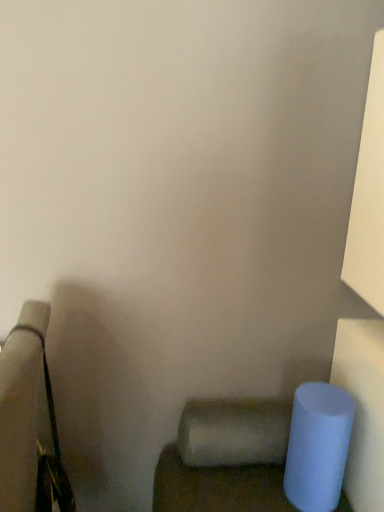
Question: From the image's perspective, is matte blue cylinder at lower right on satin white toilet paper at lower center?

Choices:
 (A) no
 (B) yes

Answer: (A)

Question: Is satin white toilet paper at lower center completely or partially inside matte blue cylinder at lower right?

Choices:
 (A) yes
 (B) no

Answer: (B)

Question: Can we say matte blue cylinder at lower right lies outside satin white toilet paper at lower center?

Choices:
 (A) no
 (B) yes

Answer: (B)

Question: Is matte blue cylinder at lower right wider than satin white toilet paper at lower center?

Choices:
 (A) no
 (B) yes

Answer: (B)

Question: Can you confirm if matte blue cylinder at lower right is positioned to the left of satin white toilet paper at lower center?

Choices:
 (A) yes
 (B) no

Answer: (B)

Question: Is satin white toilet paper at lower center at the back of matte blue cylinder at lower right?

Choices:
 (A) no
 (B) yes

Answer: (A)

Question: Can we say satin white toilet paper at lower center lies outside matte blue cylinder at lower right?

Choices:
 (A) no
 (B) yes

Answer: (B)

Question: Does satin white toilet paper at lower center lie behind matte blue cylinder at lower right?

Choices:
 (A) yes
 (B) no

Answer: (A)

Question: Could you tell me if satin white toilet paper at lower center is turned towards matte blue cylinder at lower right?

Choices:
 (A) yes
 (B) no

Answer: (B)

Question: From a real-world perspective, is satin white toilet paper at lower center located beneath matte blue cylinder at lower right?

Choices:
 (A) yes
 (B) no

Answer: (B)

Question: From a real-world perspective, is satin white toilet paper at lower center on top of matte blue cylinder at lower right?

Choices:
 (A) yes
 (B) no

Answer: (A)

Question: Can you confirm if satin white toilet paper at lower center is thinner than matte blue cylinder at lower right?

Choices:
 (A) no
 (B) yes

Answer: (B)

Question: From a real-world perspective, is satin white toilet paper at lower center positioned above or below matte blue cylinder at lower right?

Choices:
 (A) below
 (B) above

Answer: (B)